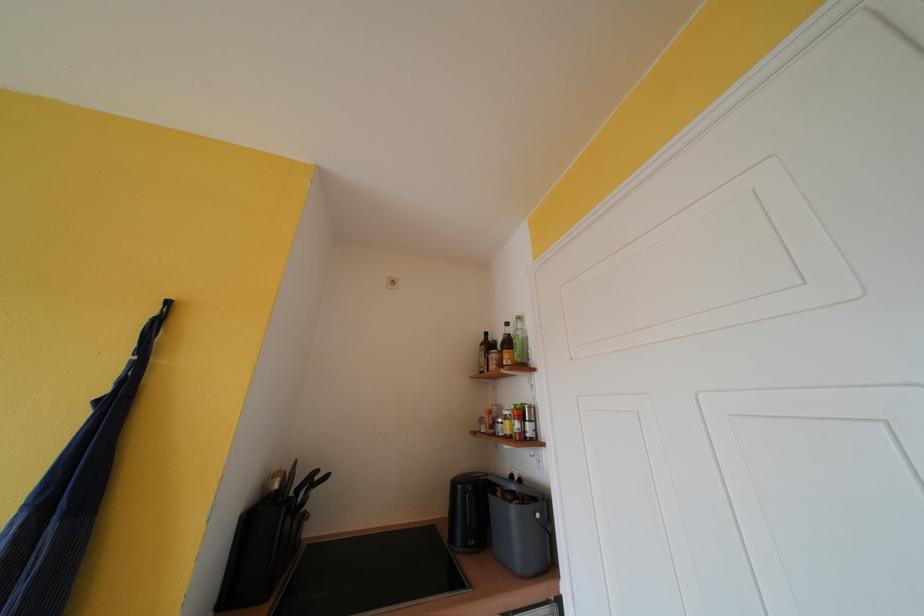
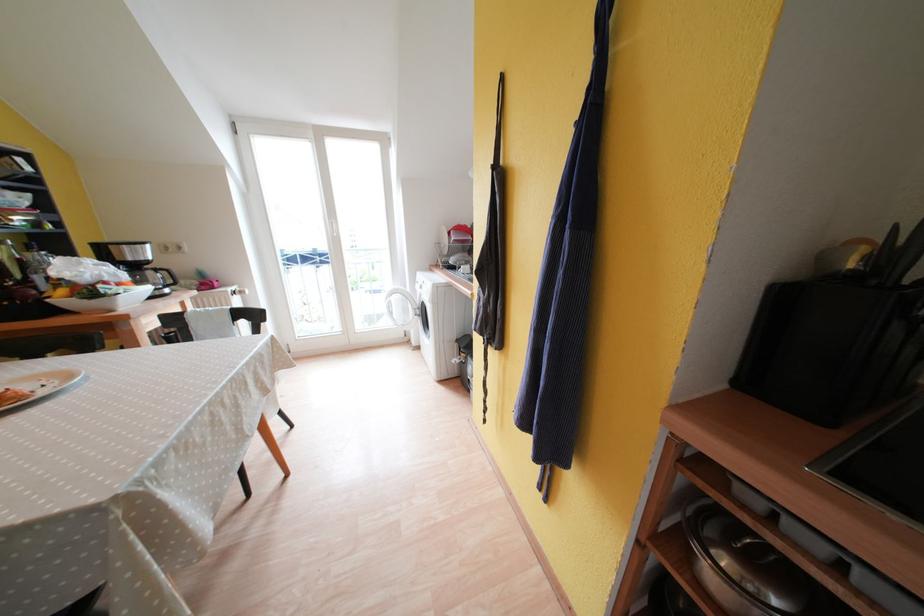
Based on the continuous images, in which direction is the camera rotating?

The rotation direction of the camera is left-down.